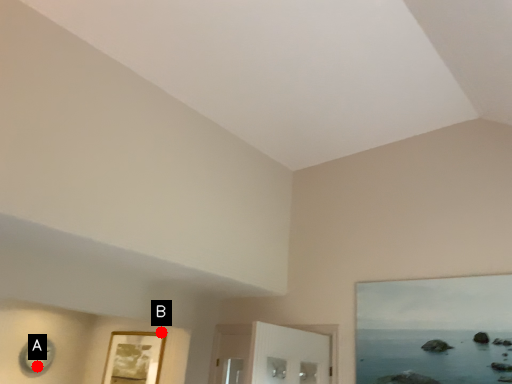
Question: Two points are circled on the image, labeled by A and B beside each circle. Among these points, which one is nearest to the camera?

Choices:
 (A) A is closer
 (B) B is closer

Answer: (A)